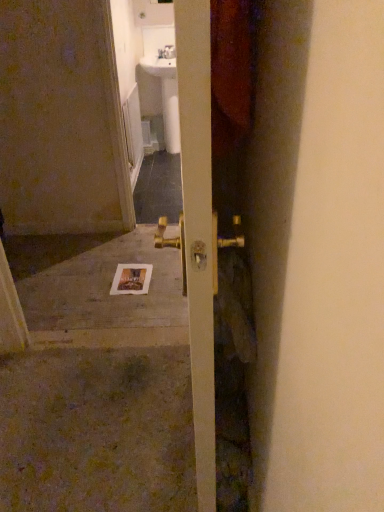
The image size is (384, 512). Describe the element at coordinates (105, 288) in the screenshot. I see `white concrete at center` at that location.

The image size is (384, 512). Describe the element at coordinates (206, 188) in the screenshot. I see `gold metallic door handle at center` at that location.

I want to click on white glossy sink at upper center, so click(166, 95).

Image resolution: width=384 pixels, height=512 pixels. What are the coordinates of `white concrete at center` in the screenshot? It's located at (105, 288).

Is gold metallic door handle at center positioned far away from white concrete at center?

Yes, gold metallic door handle at center and white concrete at center are located far from each other.

From the image's perspective, is gold metallic door handle at center located above or below white concrete at center?

Based on their image positions, gold metallic door handle at center is located above white concrete at center.

Between gold metallic door handle at center and white concrete at center, which one has more height?

gold metallic door handle at center.

How different are the orientations of gold metallic door handle at center and white glossy sink at upper center in degrees?

88.3 degrees.

Is gold metallic door handle at center next to white glossy sink at upper center and touching it?

No.

Looking at this image, is gold metallic door handle at center behind white glossy sink at upper center?

No.

Can we say white glossy sink at upper center lies outside gold metallic door handle at center?

white glossy sink at upper center lies outside gold metallic door handle at center's area.

How many degrees apart are the facing directions of white glossy sink at upper center and gold metallic door handle at center?

88.3 degrees separate the facing orientations of white glossy sink at upper center and gold metallic door handle at center.

Considering the sizes of objects white glossy sink at upper center and gold metallic door handle at center in the image provided, who is wider, white glossy sink at upper center or gold metallic door handle at center?

With larger width is white glossy sink at upper center.

Which is more to the right, white glossy sink at upper center or gold metallic door handle at center?

gold metallic door handle at center is more to the right.

From the image's perspective, would you say white paper postcard at center is shown under white glossy sink at upper center?

Correct, white paper postcard at center appears lower than white glossy sink at upper center in the image.

In the scene shown: Is the surface of white paper postcard at center in direct contact with white glossy sink at upper center?

white paper postcard at center and white glossy sink at upper center are not in contact.

Visually, is white paper postcard at center positioned to the left or to the right of white glossy sink at upper center?

Clearly, white paper postcard at center is on the left of white glossy sink at upper center in the image.

Does white paper postcard at center come in front of gold metallic door handle at center?

That is False.

Is white paper postcard at center positioned beyond the bounds of gold metallic door handle at center?

white paper postcard at center lies outside gold metallic door handle at center's area.

Can you confirm if white paper postcard at center is thinner than gold metallic door handle at center?

Incorrect, the width of white paper postcard at center is not less than that of gold metallic door handle at center.

Is white paper postcard at center looking in the opposite direction of white concrete at center?

A: Correct, white paper postcard at center is looking away from white concrete at center.

Is white paper postcard at center to the right of white concrete at center from the viewer's perspective?

Indeed, white paper postcard at center is positioned on the right side of white concrete at center.

Is white paper postcard at center with white concrete at center?

No, white paper postcard at center is not next to white concrete at center.

Does white concrete at center come behind white glossy sink at upper center?

No.

Is white concrete at center not near white glossy sink at upper center?

white concrete at center is far away from white glossy sink at upper center.

Considering the relative positions of white concrete at center and white glossy sink at upper center in the image provided, is white concrete at center to the left of white glossy sink at upper center from the viewer's perspective?

Indeed, white concrete at center is positioned on the left side of white glossy sink at upper center.

Where is `door on the right of white concrete at center`? door on the right of white concrete at center is located at coordinates (206, 188).

You are a GUI agent. You are given a task and a screenshot of the screen. Output one action in this format:
    pyautogui.click(x=<x>, y=<y>)
    Task: Click on the sink below the gold metallic door handle at center (from a real-world perspective)
    The height and width of the screenshot is (512, 384).
    Given the screenshot: What is the action you would take?
    pyautogui.click(x=166, y=95)

Looking at this image, from the image, which object appears to be farther from white glossy sink at upper center, white concrete at center or white paper postcard at center?

The object further to white glossy sink at upper center is white paper postcard at center.

When comparing their distances from white paper postcard at center, does white concrete at center or white glossy sink at upper center seem closer?

white concrete at center is positioned closer to the anchor white paper postcard at center.

Estimate the real-world distances between objects in this image. Which object is closer to white glossy sink at upper center, white paper postcard at center or white concrete at center?

white concrete at center is closer to white glossy sink at upper center.

Which object lies further to the anchor point white concrete at center, gold metallic door handle at center or white glossy sink at upper center?

Among the two, white glossy sink at upper center is located further to white concrete at center.

Based on their spatial positions, is white glossy sink at upper center or white paper postcard at center further from gold metallic door handle at center?

Based on the image, white glossy sink at upper center appears to be further to gold metallic door handle at center.

Based on their spatial positions, is gold metallic door handle at center or white glossy sink at upper center closer to white paper postcard at center?

gold metallic door handle at center.

From the image, which object appears to be farther from white concrete at center, white paper postcard at center or gold metallic door handle at center?

gold metallic door handle at center.

When comparing their distances from white glossy sink at upper center, does white paper postcard at center or gold metallic door handle at center seem closer?

white paper postcard at center lies closer to white glossy sink at upper center than the other object.

At what (x,y) coordinates should I click in order to perform the action: click on concrete between gold metallic door handle at center and white glossy sink at upper center along the z-axis. Please return your answer as a coordinate pair (x, y). The height and width of the screenshot is (512, 384). Looking at the image, I should click on (105, 288).

The image size is (384, 512). Identify the location of postcard between gold metallic door handle at center and white glossy sink at upper center along the z-axis. (131, 279).

Identify the location of concrete positioned between gold metallic door handle at center and white paper postcard at center from near to far. This screenshot has width=384, height=512. (105, 288).

Where is `postcard that lies between white glossy sink at upper center and white concrete at center from top to bottom`? postcard that lies between white glossy sink at upper center and white concrete at center from top to bottom is located at coordinates (131, 279).